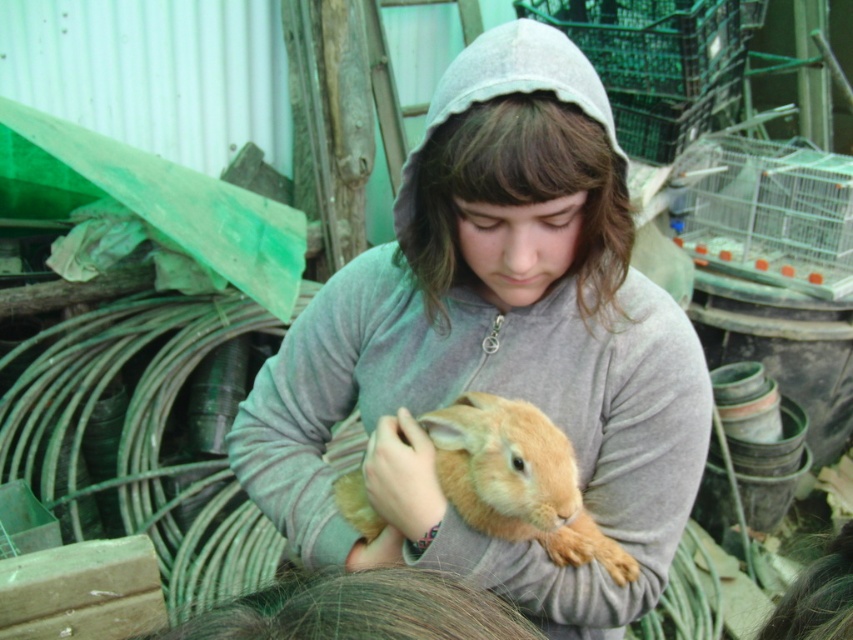
Question: Which point appears closest to the camera in this image?

Choices:
 (A) (258, 428)
 (B) (555, 468)

Answer: (B)

Question: Is matte gray hoodie at center wider than light brown fur at center?

Choices:
 (A) yes
 (B) no

Answer: (A)

Question: Which point is farther from the camera taking this photo?

Choices:
 (A) (442, 321)
 (B) (554, 531)

Answer: (A)

Question: Does matte gray hoodie at center have a larger size compared to light brown fur at center?

Choices:
 (A) no
 (B) yes

Answer: (B)

Question: Is matte gray hoodie at center positioned in front of light brown fur at center?

Choices:
 (A) yes
 (B) no

Answer: (A)